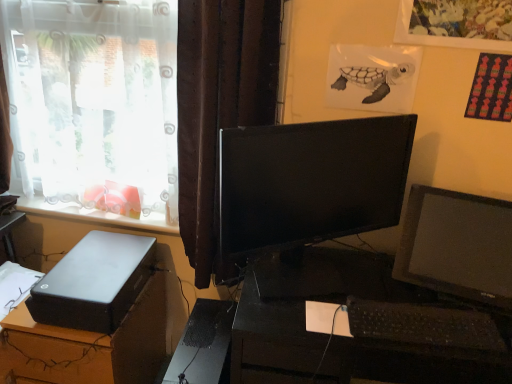
Locate an element on the screen. free space that is to the left of black plastic keyboard at lower right is located at coordinates point(319,307).